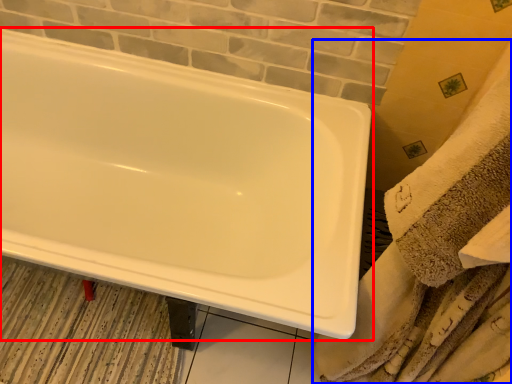
Question: Which object appears farthest to the camera in this image, bathtub (highlighted by a red box) or bath towel (highlighted by a blue box)?

Choices:
 (A) bathtub
 (B) bath towel

Answer: (A)